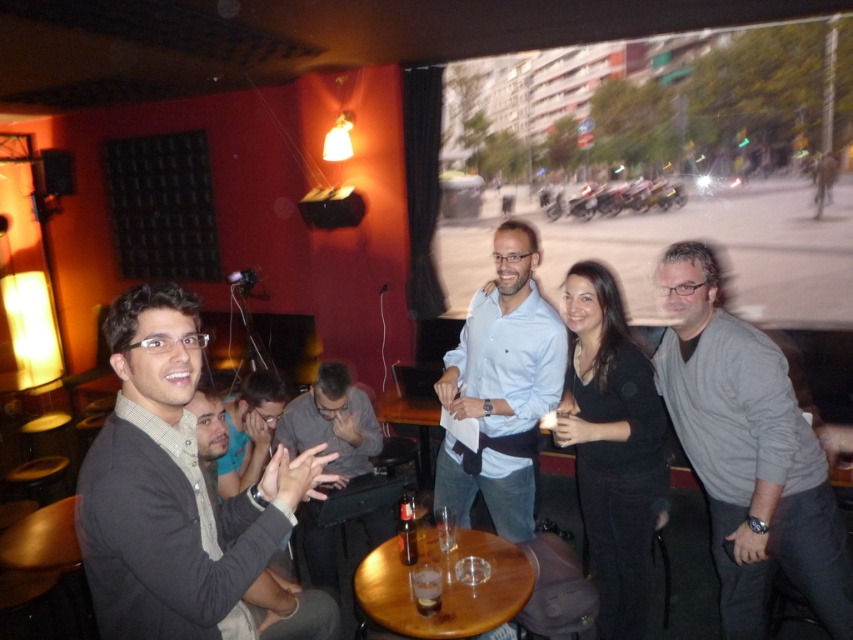
You are a bartender preparing drinks at the table. You have a translucent glass bottle at center containing a new batch of cocktail mix. You need to place it somewhere stable. Is the translucent glass at table center a suitable base for the bottle?

The translucent glass at table center is positioned under the translucent glass bottle at center, meaning the bottle is already resting on the glass. Therefore, the glass is currently supporting the bottle, so it is a suitable base.